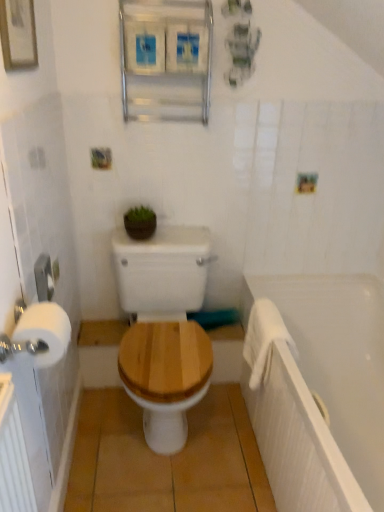
Question: Is white soft towel at right at the left side of white matte bathtub at right?

Choices:
 (A) yes
 (B) no

Answer: (A)

Question: Does white soft towel at right have a smaller size compared to white matte bathtub at right?

Choices:
 (A) no
 (B) yes

Answer: (B)

Question: Is white matte bathtub at right surrounded by white soft towel at right?

Choices:
 (A) yes
 (B) no

Answer: (B)

Question: Does white soft towel at right have a lesser height compared to white matte bathtub at right?

Choices:
 (A) no
 (B) yes

Answer: (B)

Question: From the image's perspective, is white soft towel at right below white matte bathtub at right?

Choices:
 (A) yes
 (B) no

Answer: (B)

Question: In terms of height, does white plastic towel bar at left look taller or shorter compared to white soft towel at right?

Choices:
 (A) tall
 (B) short

Answer: (B)

Question: From the image's perspective, is white plastic towel bar at left located above or below white soft towel at right?

Choices:
 (A) above
 (B) below

Answer: (A)

Question: Considering the positions of white plastic towel bar at left and white soft towel at right in the image, is white plastic towel bar at left wider or thinner than white soft towel at right?

Choices:
 (A) thin
 (B) wide

Answer: (A)

Question: From a real-world perspective, is white plastic towel bar at left above or below white soft towel at right?

Choices:
 (A) above
 (B) below

Answer: (A)

Question: Is white soft towel at right spatially inside green matte plant at upper center, or outside of it?

Choices:
 (A) inside
 (B) outside

Answer: (B)

Question: From the image's perspective, is white soft towel at right positioned above or below green matte plant at upper center?

Choices:
 (A) below
 (B) above

Answer: (A)

Question: Based on their positions, is white soft towel at right located to the left or right of green matte plant at upper center?

Choices:
 (A) right
 (B) left

Answer: (A)

Question: Considering the positions of point (251, 324) and point (152, 212), is point (251, 324) closer or farther from the camera than point (152, 212)?

Choices:
 (A) farther
 (B) closer

Answer: (B)

Question: Relative to green matte plant at upper center, is metallic silver medicine cabinet at upper center in front or behind?

Choices:
 (A) front
 (B) behind

Answer: (A)

Question: From a real-world perspective, is metallic silver medicine cabinet at upper center positioned above or below green matte plant at upper center?

Choices:
 (A) below
 (B) above

Answer: (B)